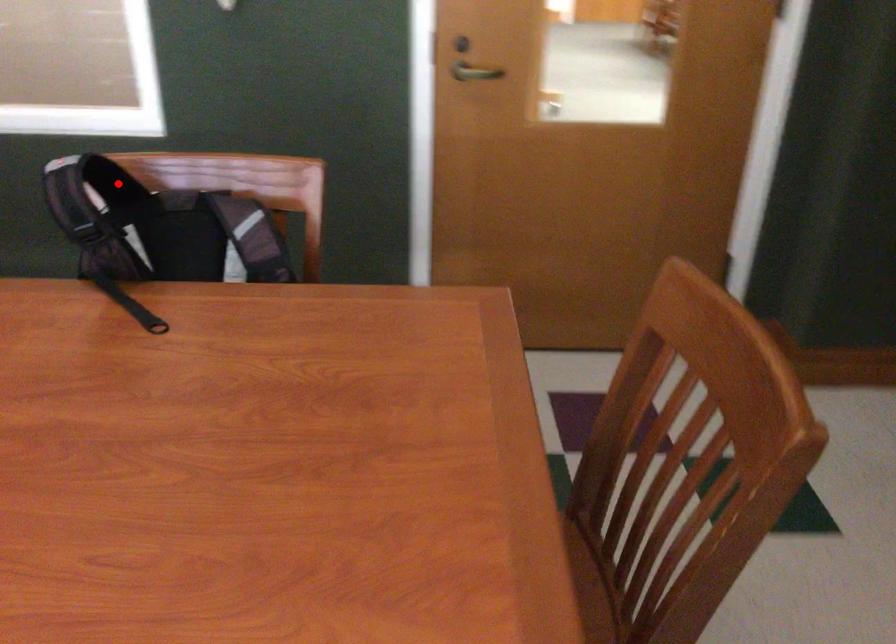
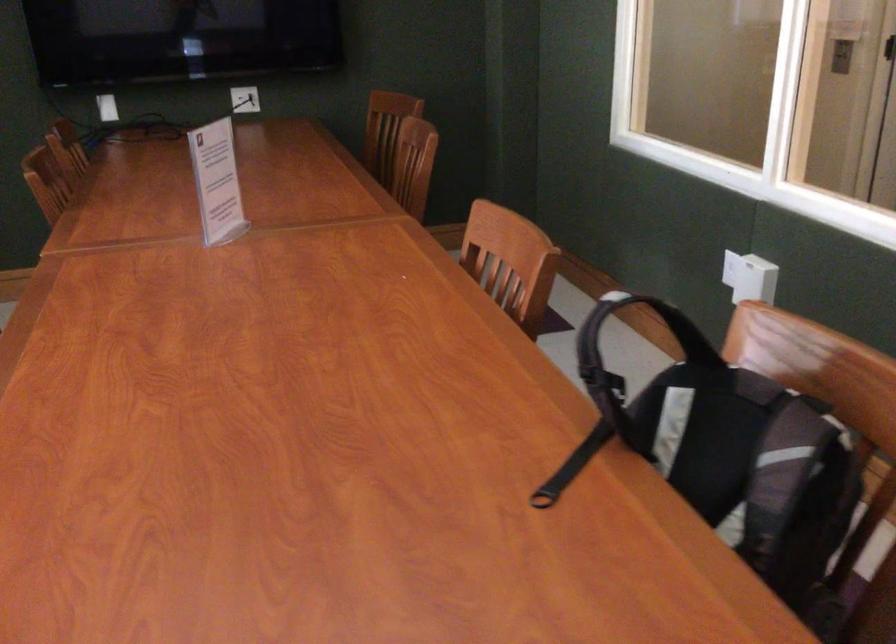
The point at the highlighted location is marked in the first image. Where is the corresponding point in the second image?

(690, 337)